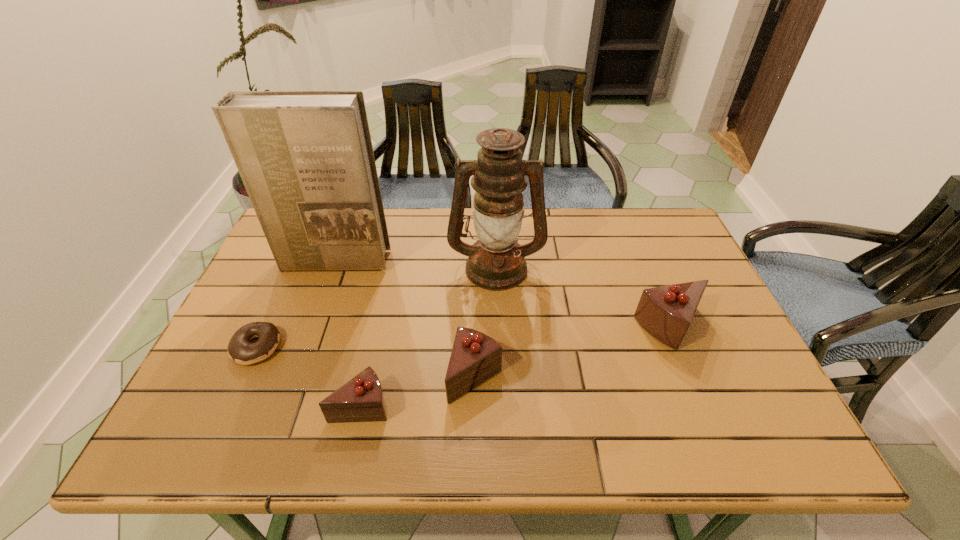
Locate an element on the screen. vacant position located on the back of the rightmost chocolate cake is located at coordinates (647, 268).

Where is `free point located on the cover of the phonebook`? The height and width of the screenshot is (540, 960). free point located on the cover of the phonebook is located at coordinates (309, 329).

This screenshot has height=540, width=960. Find the location of `blank area located on the right of the lantern`. blank area located on the right of the lantern is located at coordinates (615, 267).

Locate an element on the screen. The width and height of the screenshot is (960, 540). vacant region located 0.100m on the front of the doughnut is located at coordinates point(228,407).

Locate an element on the screen. phonebook situated at the far edge is located at coordinates (306, 159).

Locate an element on the screen. This screenshot has width=960, height=540. lantern situated at the far edge is located at coordinates (496, 262).

This screenshot has height=540, width=960. I want to click on phonebook situated at the left edge, so click(x=306, y=159).

Locate an element on the screen. doughnut positioned at the left edge is located at coordinates (240, 350).

The width and height of the screenshot is (960, 540). I want to click on object that is at the right edge, so click(666, 312).

Identify the location of object present at the far left corner. (306, 159).